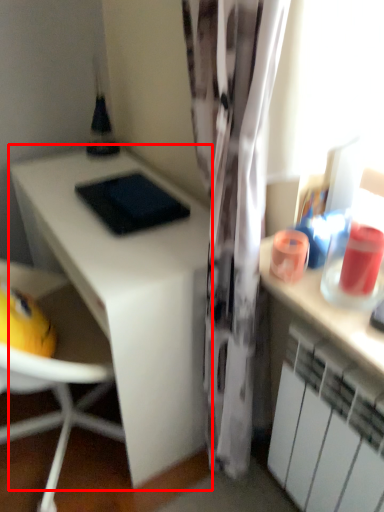
Question: Considering the relative positions of desk (annotated by the red box) and cabinetry in the image provided, where is desk (annotated by the red box) located with respect to the staircase?

Choices:
 (A) left
 (B) right

Answer: (A)